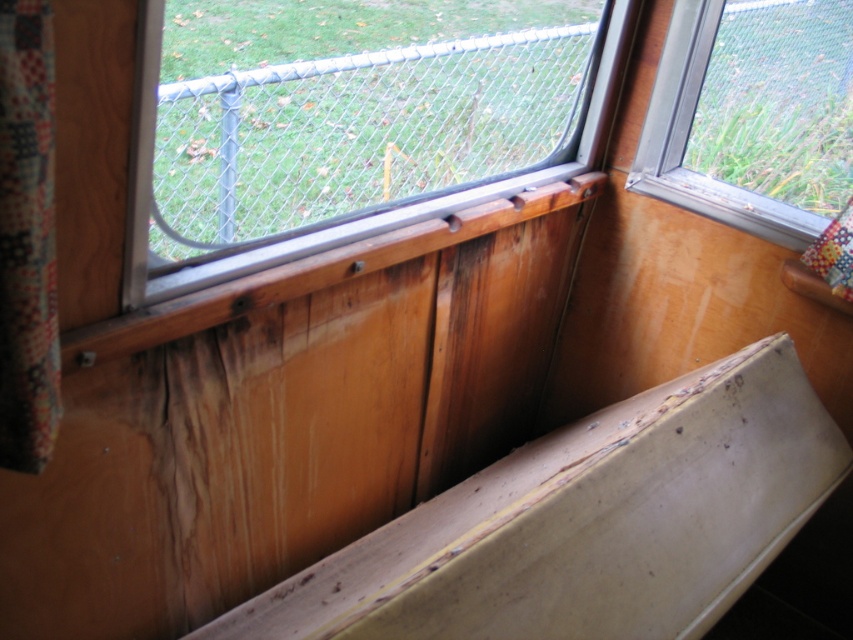
In the scene shown: Between metal chain-link fence at upper center and clear glass window at upper right, which one appears on the right side from the viewer's perspective?

From the viewer's perspective, clear glass window at upper right appears more on the right side.

Is metal chain-link fence at upper center wider than clear glass window at upper right?

Yes.

Does point (254, 68) lie behind point (734, 52)?

That is True.

Find the location of `metal chain-link fence at upper center`. metal chain-link fence at upper center is located at coordinates (352, 109).